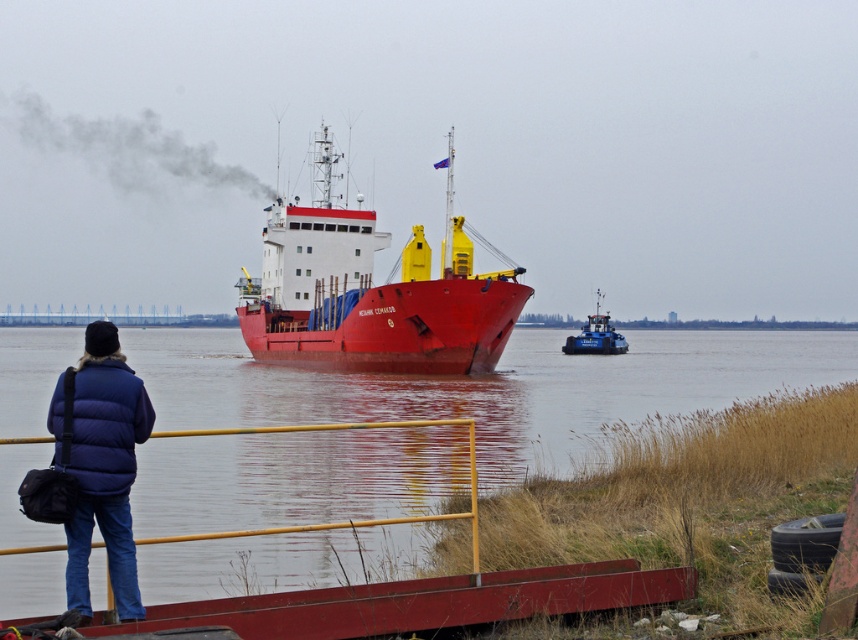
You are standing on the red platform and want to walk to the smooth wood dock at lower center. Which direction should you move relative to the yellow metal rail at lower center?

You should move to the right of the yellow metal rail at lower center to reach the smooth wood dock at lower center since the smooth wood dock at lower center is located to the right of it.

You are a photographer standing on the red platform. You want to capture a photo of the blue metallic tugboat at center and the smooth water at ship front in the same frame. Which object will occupy more space in the photo?

The smooth water at ship front is larger in size than the blue metallic tugboat at center, so it will occupy more space in the photo.

You are standing on the smooth wood dock at lower center and want to reach the yellow metal rail at lower center. Can you walk directly to it without stepping off the dock?

The smooth wood dock at lower center is shorter than the yellow metal rail at lower center, so you cannot walk directly to it without stepping off the dock because the dock is shorter in length than the rail.